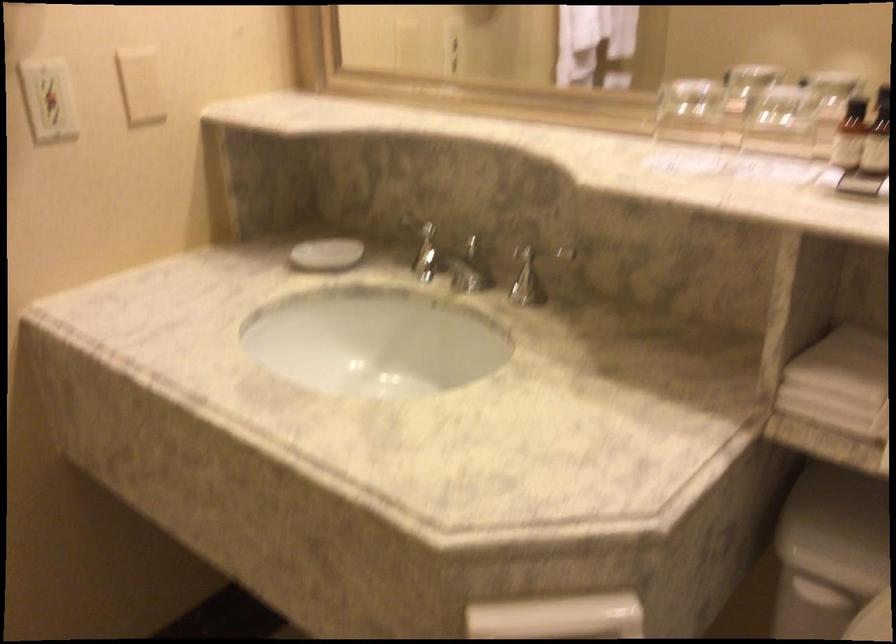
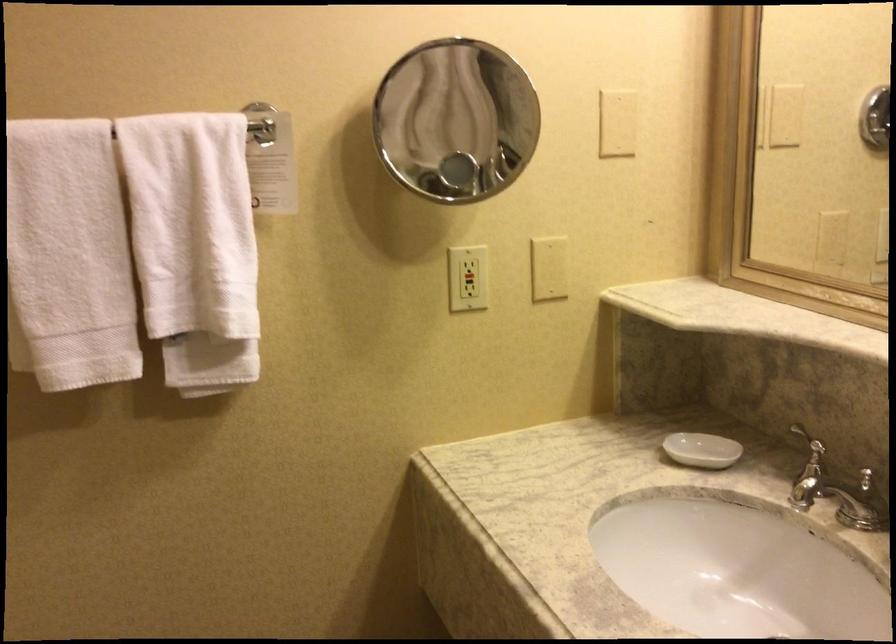
In the second image, find the point that corresponds to point (324, 257) in the first image.

(702, 450)